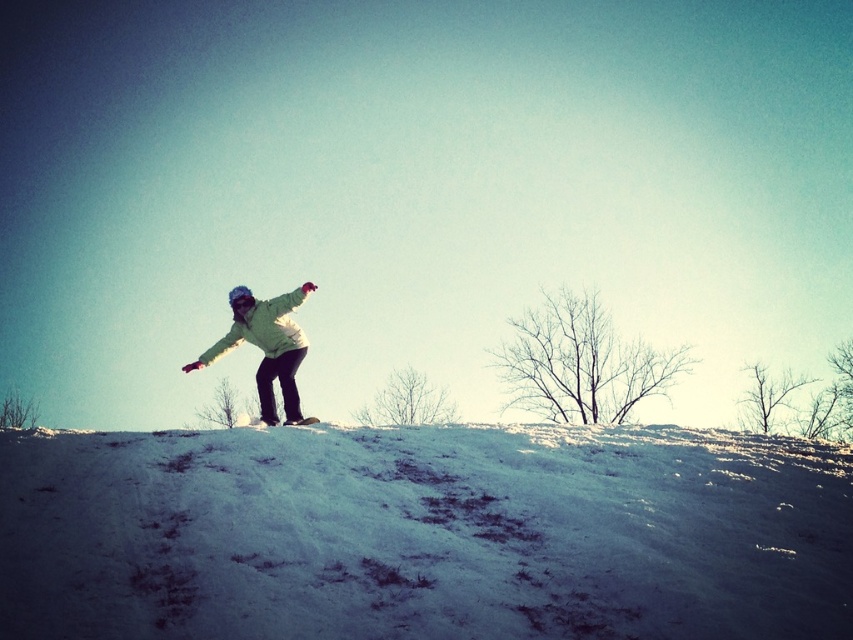
Which is more to the left, white powdery snow at center or light green fabric snowboarder at center?

light green fabric snowboarder at center

Consider the image. Does white powdery snow at center appear on the left side of light green fabric snowboarder at center?

No, white powdery snow at center is not to the left of light green fabric snowboarder at center.

Find the location of a particular element. The image size is (853, 640). white powdery snow at center is located at coordinates (422, 534).

Is white powdery snow at center to the right of white matte snowboard at center from the viewer's perspective?

Indeed, white powdery snow at center is positioned on the right side of white matte snowboard at center.

Which is in front, point (106, 544) or point (244, 413)?

Point (106, 544)

Between point (56, 540) and point (305, 426), which one is positioned in front?

Point (56, 540) is more forward.

The image size is (853, 640). I want to click on white powdery snow at center, so click(x=422, y=534).

Does light green fabric snowboarder at center appear on the left side of white matte snowboard at center?

Incorrect, light green fabric snowboarder at center is not on the left side of white matte snowboard at center.

Is light green fabric snowboarder at center behind white matte snowboard at center?

Yes, it is.

Image resolution: width=853 pixels, height=640 pixels. I want to click on light green fabric snowboarder at center, so click(x=265, y=348).

Find the location of `light green fabric snowboarder at center`. light green fabric snowboarder at center is located at coordinates (265, 348).